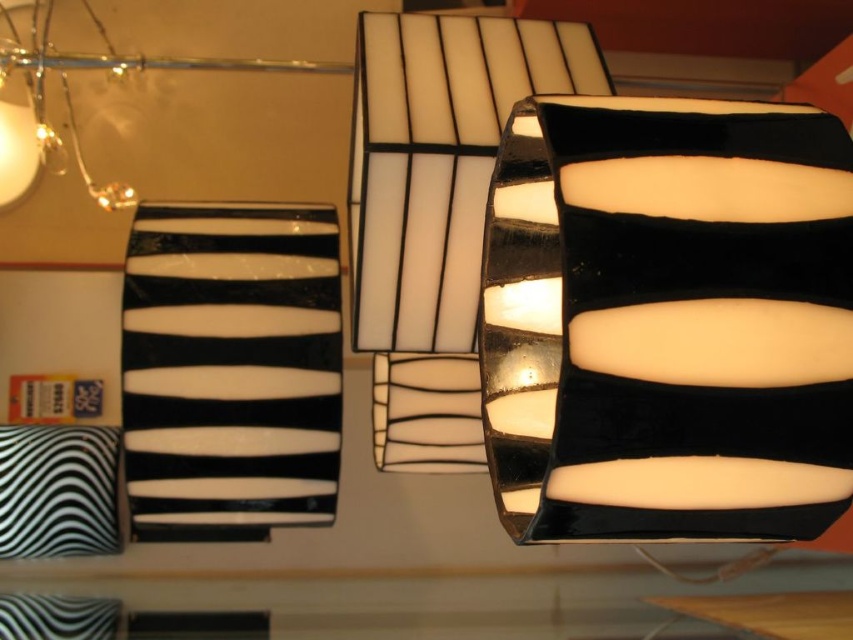
Does translucent glass lampshade at upper center appear on the right side of zebra-patterned fabric pillow at lower left?

Indeed, translucent glass lampshade at upper center is positioned on the right side of zebra-patterned fabric pillow at lower left.

Does point (424, 394) come in front of point (49, 516)?

Yes, it is.

Where is `translucent glass lampshade at upper center`? Image resolution: width=853 pixels, height=640 pixels. translucent glass lampshade at upper center is located at coordinates (436, 209).

Can you confirm if black glossy lampshade at center is positioned below translucent glass lampshade at upper center?

Yes.

Does black glossy lampshade at center lie behind translucent glass lampshade at upper center?

No, it is not.

Is point (849, 240) behind point (422, 196)?

No, (849, 240) is closer to viewer.

Find the location of a particular element. Image resolution: width=853 pixels, height=640 pixels. black glossy lampshade at center is located at coordinates click(668, 321).

Is black glossy lampshade at left wider than zebra-patterned fabric pillow at lower left?

Yes, black glossy lampshade at left is wider than zebra-patterned fabric pillow at lower left.

Between point (291, 250) and point (48, 529), which one is positioned in front?

Point (291, 250) is more forward.

You are a GUI agent. You are given a task and a screenshot of the screen. Output one action in this format:
    pyautogui.click(x=<x>, y=<y>)
    Task: Click on the black glossy lampshade at left
    
    Given the screenshot: What is the action you would take?
    pyautogui.click(x=231, y=369)

At what (x,y) coordinates should I click in order to perform the action: click on black glossy lampshade at left. Please return your answer as a coordinate pair (x, y). This screenshot has height=640, width=853. Looking at the image, I should click on (231, 369).